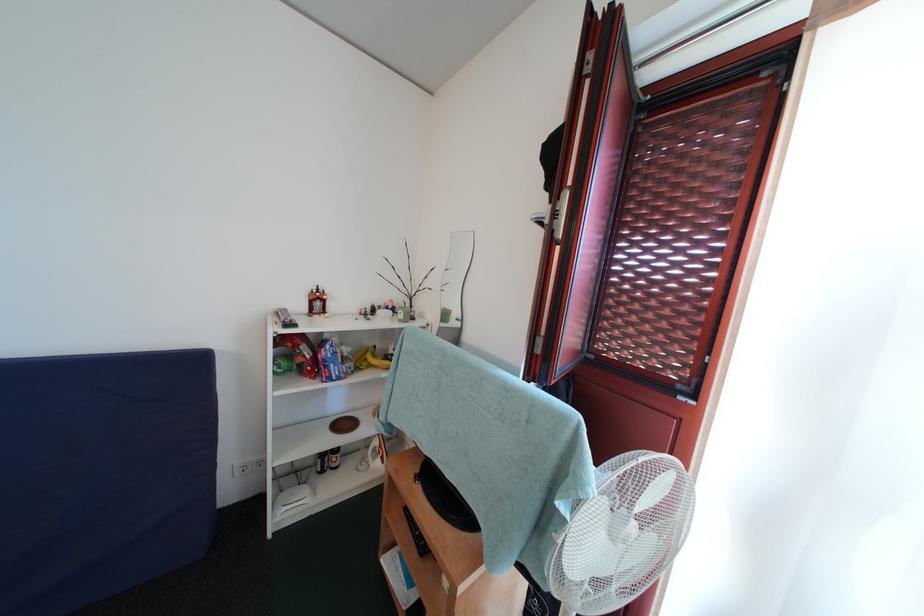
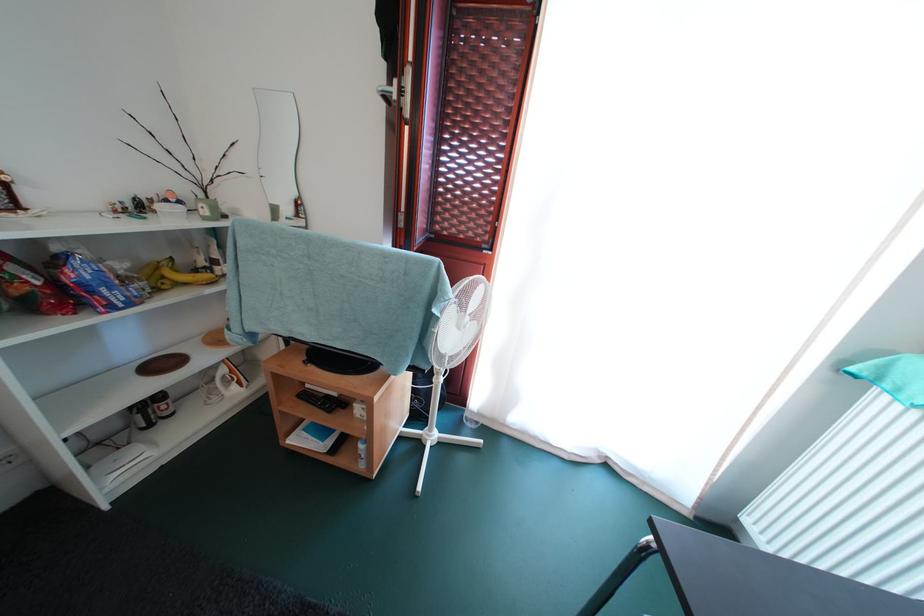
Where in the second image is the point corresponding to point 351,363 from the first image?

(131, 285)